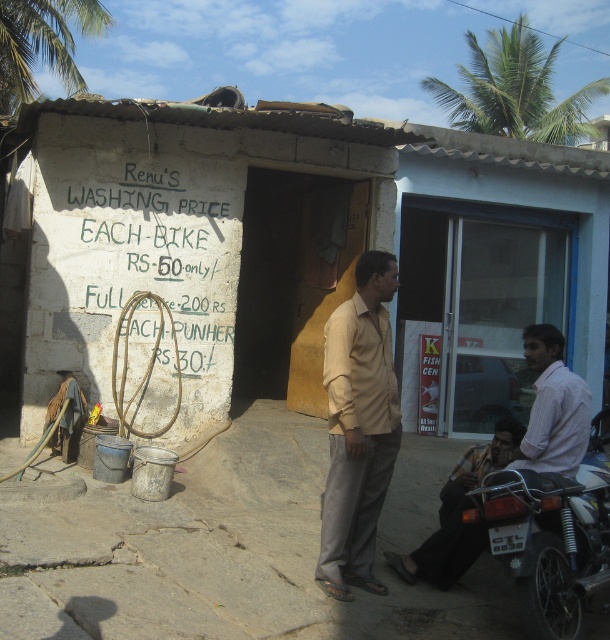
Question: Which of the following is the closest to the observer?

Choices:
 (A) (346, 388)
 (B) (470, 525)

Answer: (A)

Question: Which point is farther from the camera taking this photo?

Choices:
 (A) (475, 115)
 (B) (339, 308)
 (C) (556, 541)

Answer: (A)

Question: Does beige fabric shirt at center have a smaller size compared to metallic silver motorcycle at lower right?

Choices:
 (A) no
 (B) yes

Answer: (B)

Question: Is beige fabric shirt at center below plaid fabric shirt at lower center?

Choices:
 (A) no
 (B) yes

Answer: (A)

Question: Observing the image, what is the correct spatial positioning of white concrete wall at center in reference to green leafy palm tree at upper left?

Choices:
 (A) right
 (B) left

Answer: (A)

Question: Considering the real-world distances, which object is closest to the plaid fabric shirt at lower center?

Choices:
 (A) white concrete wall at center
 (B) green leafy palm tree at upper left

Answer: (A)